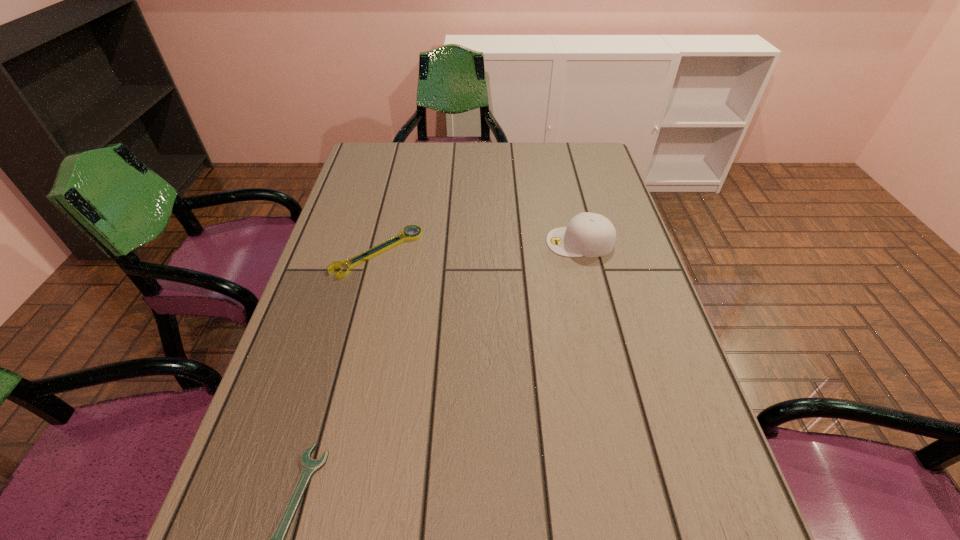
Identify the location of blank space that satisfies the following two spatial constraints: 1. on the front-facing side of the cap; 2. on the front side of the farther wrench. The width and height of the screenshot is (960, 540). (583, 252).